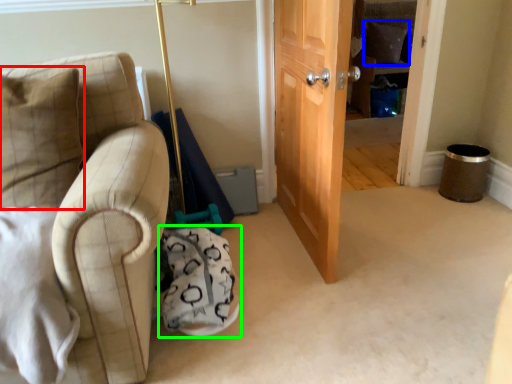
Question: Which object is the farthest from pillow (highlighted by a red box)? Choose among these: pillow (highlighted by a blue box) or swivel chair (highlighted by a green box).

Choices:
 (A) pillow
 (B) swivel chair

Answer: (A)